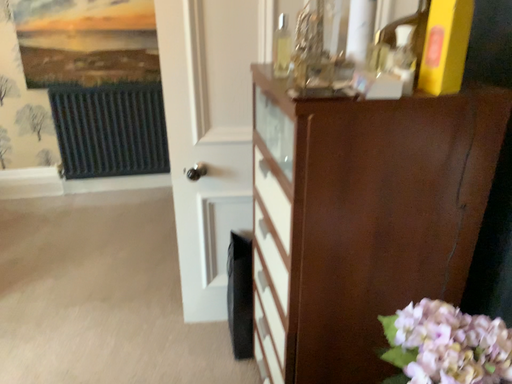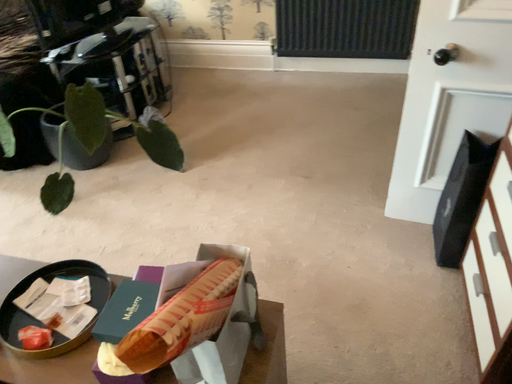
Question: How did the camera likely rotate when shooting the video?

Choices:
 (A) rotated left
 (B) rotated right

Answer: (A)